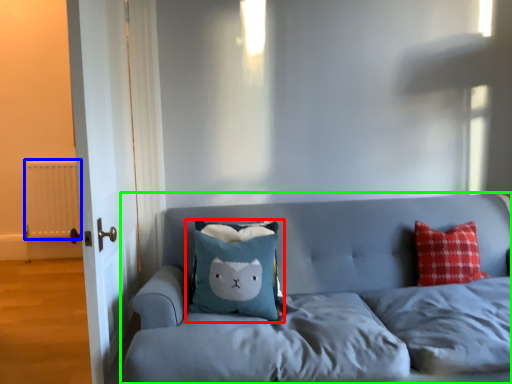
Question: Based on their relative distances, which object is farther from pillow (highlighted by a red box)? Choose from radiator (highlighted by a blue box) and studio couch (highlighted by a green box).

Choices:
 (A) radiator
 (B) studio couch

Answer: (A)